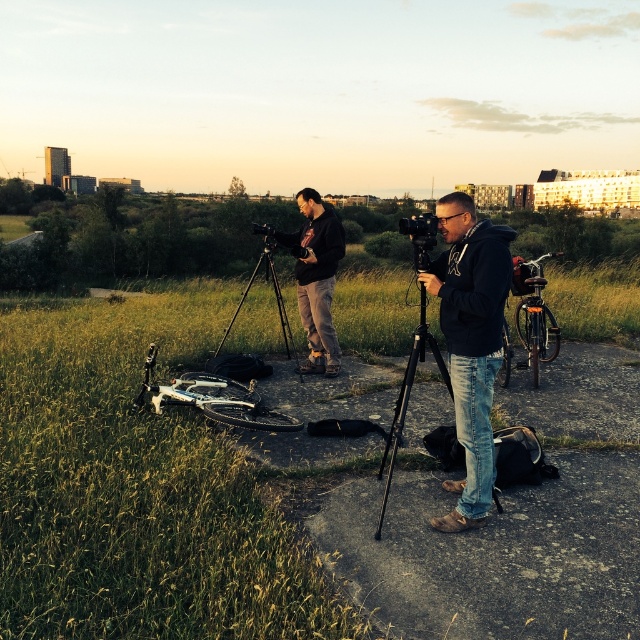
From the picture: Can you confirm if black matte jacket at center is thinner than matte black tripod at center?

Yes, black matte jacket at center is thinner than matte black tripod at center.

Is black matte jacket at center smaller than matte black tripod at center?

Yes.

Which is behind, point (444, 257) or point (307, 216)?

The point (307, 216) is more distant.

At what (x,y) coordinates should I click in order to perform the action: click on black matte jacket at center. Please return your answer as a coordinate pair (x, y). Looking at the image, I should click on (470, 342).

Looking at this image, which of these two, black matte tripod at center or black plastic camera at center, stands shorter?

black plastic camera at center

Is black matte tripod at center shorter than black plastic camera at center?

Incorrect, black matte tripod at center's height does not fall short of black plastic camera at center's.

Is point (266, 250) positioned behind point (422, 216)?

Yes, point (266, 250) is farther from viewer.

This screenshot has width=640, height=640. I want to click on black matte tripod at center, so (x=273, y=291).

Is point (330, 316) positioned behind point (284, 323)?

That is False.

Does matte black tripod at center have a lesser width compared to black matte tripod at center?

Yes, matte black tripod at center is thinner than black matte tripod at center.

Identify the location of matte black tripod at center. (316, 278).